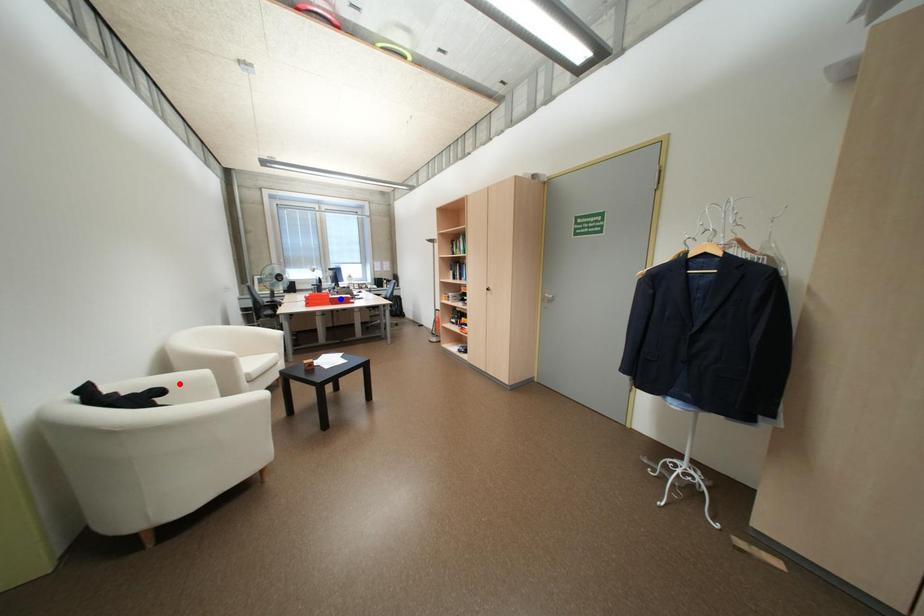
Question: In the image, two points are highlighted. Which point is nearer to the camera? Reply with the corresponding letter.

Choices:
 (A) blue point
 (B) red point

Answer: (B)